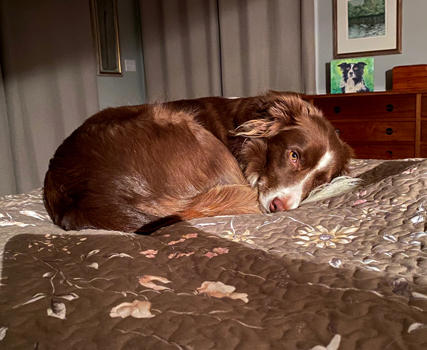
The image size is (427, 350). I want to click on walls, so click(407, 34), click(125, 94).